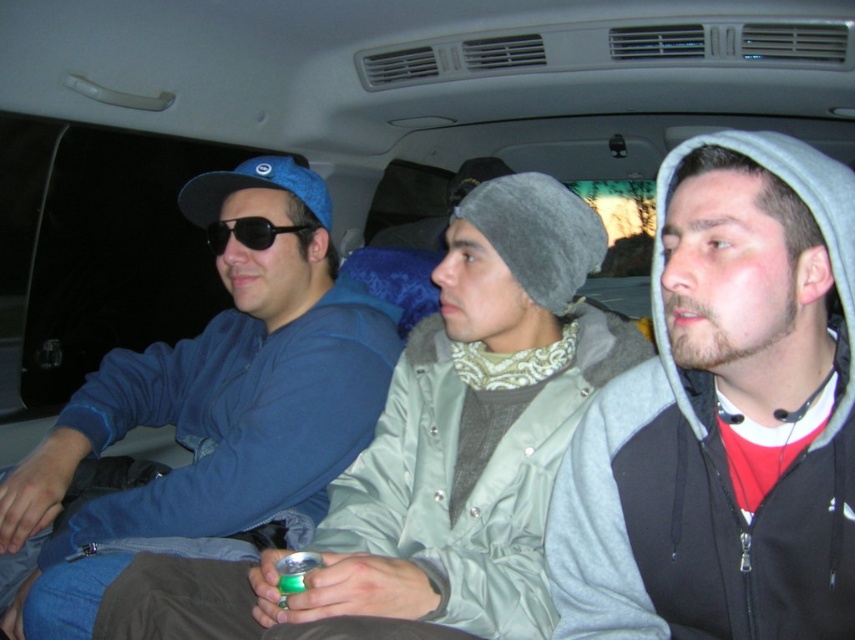
Question: Does gray fleece hoodie at right lie behind matte blue jacket at center?

Choices:
 (A) no
 (B) yes

Answer: (A)

Question: Considering the real-world distances, which object is closest to the matte blue hoodie at left?

Choices:
 (A) gray fleece hoodie at right
 (B) matte blue jacket at center

Answer: (B)

Question: Can you confirm if matte blue hoodie at left is wider than black matte sunglasses at center?

Choices:
 (A) yes
 (B) no

Answer: (A)

Question: Does matte blue hoodie at left appear over black matte sunglasses at center?

Choices:
 (A) yes
 (B) no

Answer: (B)

Question: Estimate the real-world distances between objects in this image. Which object is farther from the black matte sunglasses at center?

Choices:
 (A) matte blue jacket at center
 (B) gray fleece hoodie at right
 (C) matte blue hoodie at left

Answer: (B)

Question: Among these points, which one is farthest from the camera?

Choices:
 (A) (709, 362)
 (B) (313, 225)
 (C) (328, 525)

Answer: (B)